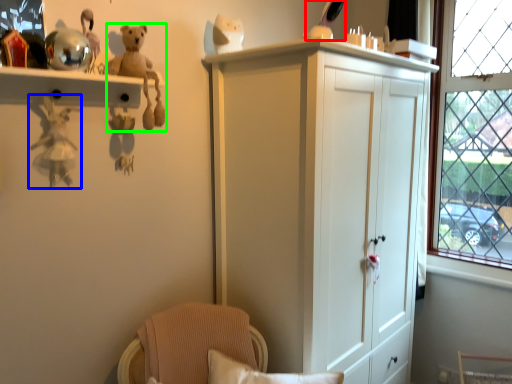
Question: Estimate the real-world distances between objects in this image. Which object is closer to toy (highlighted by a red box), toy (highlighted by a blue box) or toy (highlighted by a green box)?

Choices:
 (A) toy
 (B) toy

Answer: (B)